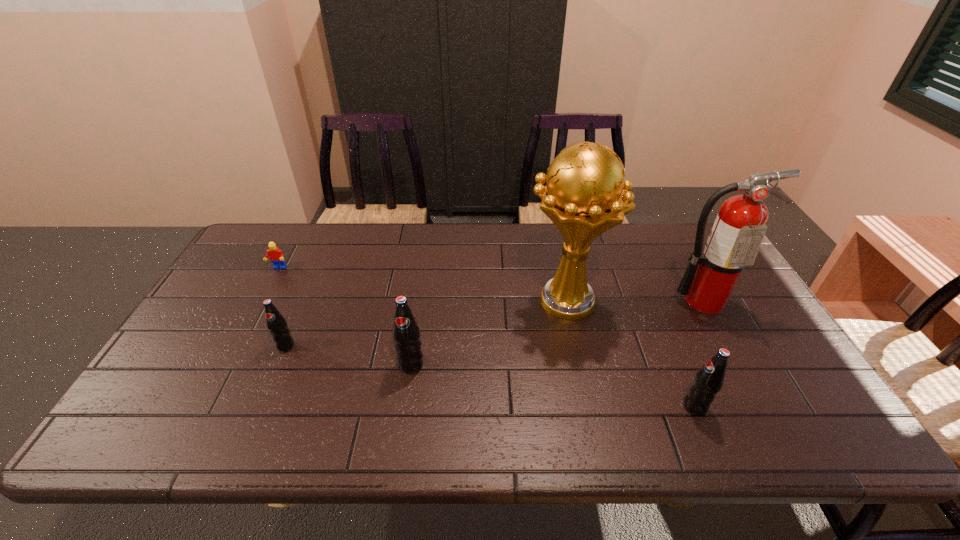
The image size is (960, 540). I want to click on free location located 0.130m on the front label of the fifth object from right to left, so click(265, 396).

Find the location of a particular element. The height and width of the screenshot is (540, 960). vacant position located 0.350m on the front label of the third shortest object is located at coordinates (533, 406).

Where is `free space located on the front label of the third shortest object`? Image resolution: width=960 pixels, height=540 pixels. free space located on the front label of the third shortest object is located at coordinates (550, 406).

Identify the location of vacant space located 0.340m on the front label of the third shortest object. (538, 406).

Where is `vacant space located on the front-facing side of the leftmost object`? vacant space located on the front-facing side of the leftmost object is located at coordinates (266, 291).

Image resolution: width=960 pixels, height=540 pixels. In order to click on free spot located on the nozzle side of the fire extinguisher in this screenshot , I will do `click(758, 400)`.

The image size is (960, 540). In order to click on vacant point located 0.390m at the front of the trophy_cup where the globe is prominent in this screenshot , I will do `click(391, 301)`.

This screenshot has width=960, height=540. I want to click on vacant area situated 0.330m at the front of the trophy_cup where the globe is prominent, so click(x=411, y=301).

The height and width of the screenshot is (540, 960). I want to click on free space located 0.270m at the front of the trophy_cup where the globe is prominent, so click(x=431, y=301).

The width and height of the screenshot is (960, 540). Find the location of `object situated at the far edge`. object situated at the far edge is located at coordinates (276, 256).